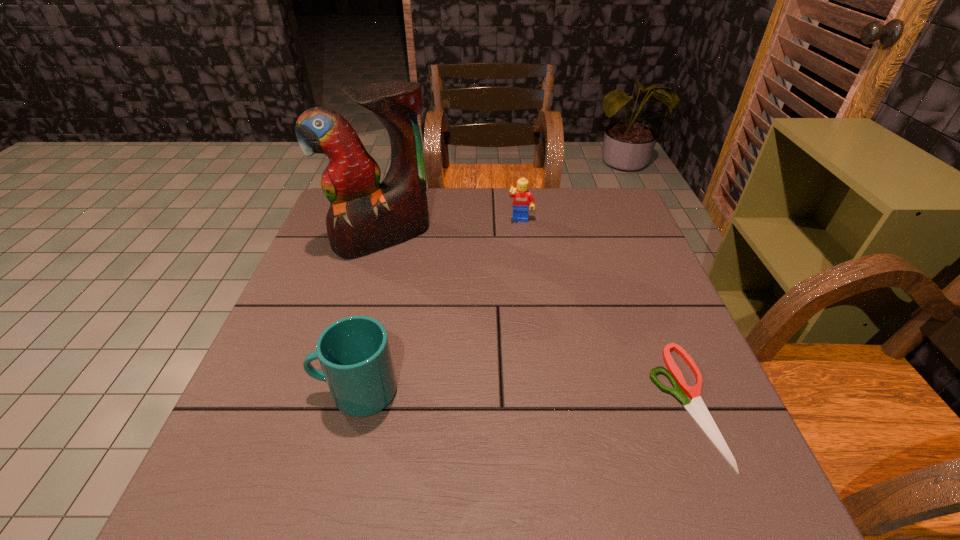
At what (x,y) coordinates should I click in order to perform the action: click on cup. Please return your answer as a coordinate pair (x, y). The height and width of the screenshot is (540, 960). Looking at the image, I should click on (354, 353).

Identify the location of scissors. (696, 408).

Locate an element on the screen. The image size is (960, 540). the shortest object is located at coordinates (696, 408).

Where is `the third object from left to right`? The width and height of the screenshot is (960, 540). the third object from left to right is located at coordinates (523, 200).

Locate an element on the screen. parrot is located at coordinates (365, 216).

What are the coordinates of `vacant area situated 0.140m on the handle side of the cup` in the screenshot? It's located at (241, 392).

Locate an element on the screen. The width and height of the screenshot is (960, 540). vacant space located on the left of the shortest object is located at coordinates (611, 402).

This screenshot has height=540, width=960. Find the location of `free space located on the face of the second object from right to left`. free space located on the face of the second object from right to left is located at coordinates (518, 238).

Locate an element on the screen. The width and height of the screenshot is (960, 540). vacant space located 0.060m on the face of the second object from right to left is located at coordinates (518, 238).

What are the coordinates of `vacant space located 0.110m on the face of the second object from right to left` in the screenshot? It's located at (517, 249).